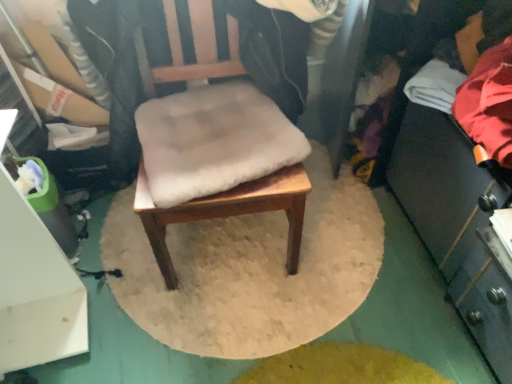
Locate an element on the screen. Image resolution: width=512 pixels, height=384 pixels. free spot above white soft cushion at center (from a real-world perspective) is located at coordinates (209, 145).